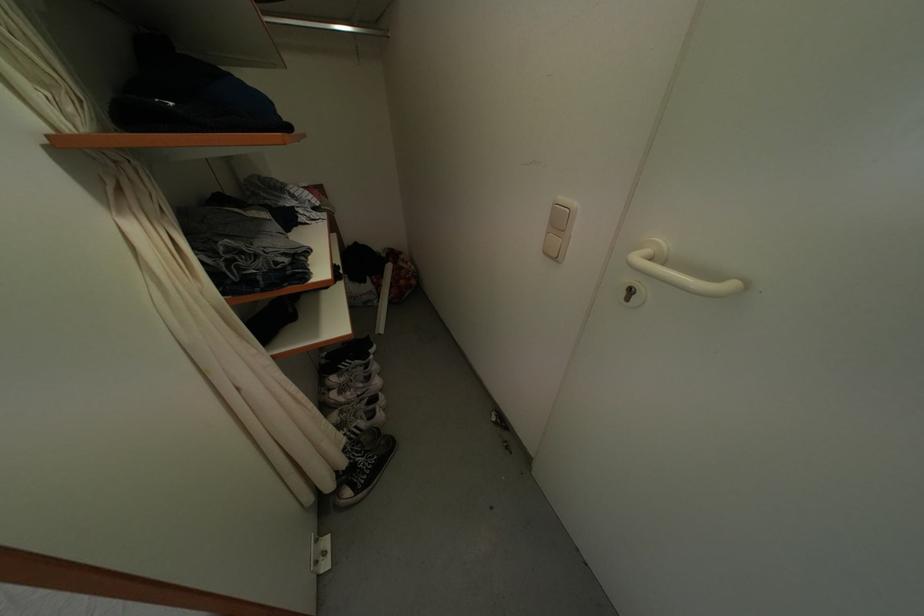
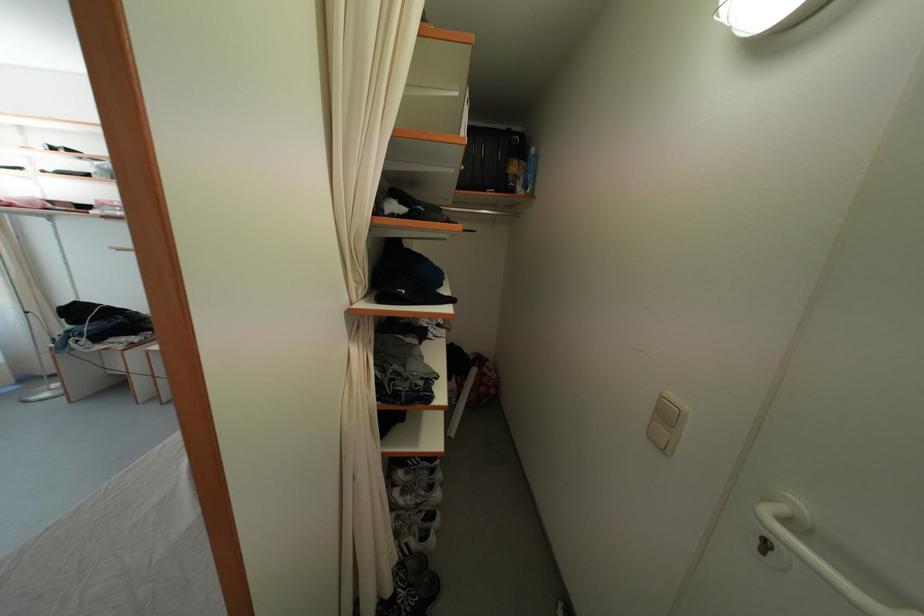
The point at (653, 257) is marked in the first image. Where is the corresponding point in the second image?

(787, 515)